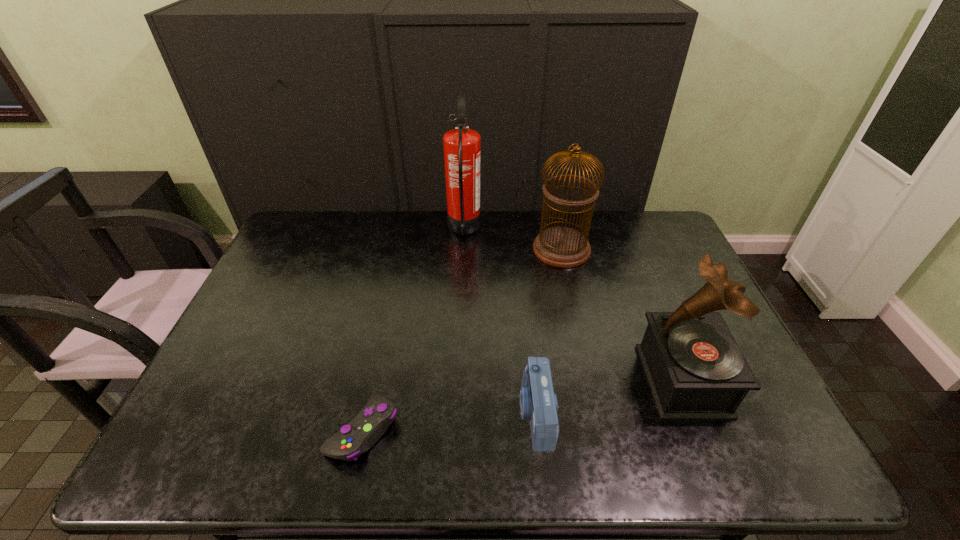
The image size is (960, 540). What are the coordinates of `camera present at the near edge` in the screenshot? It's located at (538, 403).

At what (x,y) coordinates should I click in order to perform the action: click on control situated at the near edge. Please return your answer as a coordinate pair (x, y). This screenshot has height=540, width=960. Looking at the image, I should click on [357, 437].

Where is `object present at the right edge`? object present at the right edge is located at coordinates 695,370.

Find the location of a particular element. The image size is (960, 540). vacant space at the far edge is located at coordinates (332, 241).

The image size is (960, 540). In the image, there is a desktop. In order to click on vacant space at the near edge in this screenshot , I will do `click(257, 442)`.

Locate an element on the screen. The height and width of the screenshot is (540, 960). free space at the left edge is located at coordinates (214, 378).

Identify the location of free location at the right edge of the desktop. (674, 261).

In the image, there is a desktop. At what (x,y) coordinates should I click in order to perform the action: click on free space at the far right corner. Please return your answer as a coordinate pair (x, y). The image size is (960, 540). Looking at the image, I should click on point(622,211).

What are the coordinates of `vacant area at the near right corner` in the screenshot? It's located at (799, 459).

What are the coordinates of `vacant area that lies between the camera and the leftmost object` in the screenshot? It's located at (449, 422).